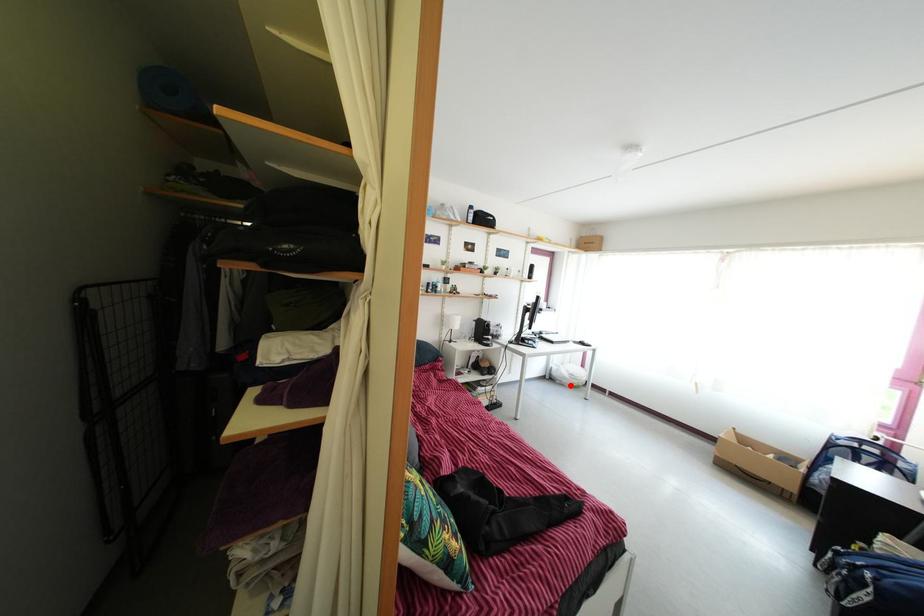
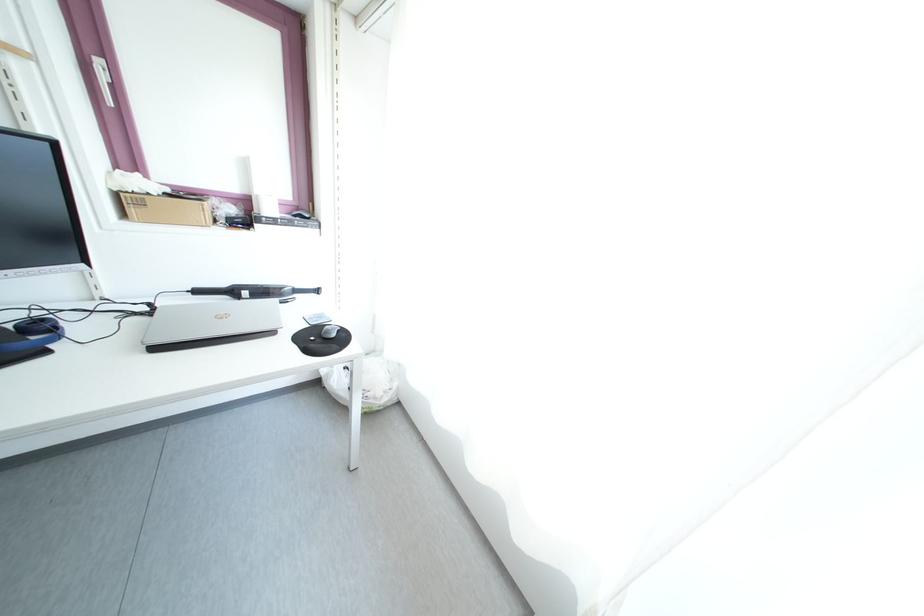
Find the pixel in the second image that matches the highlighted location in the first image.

(344, 403)